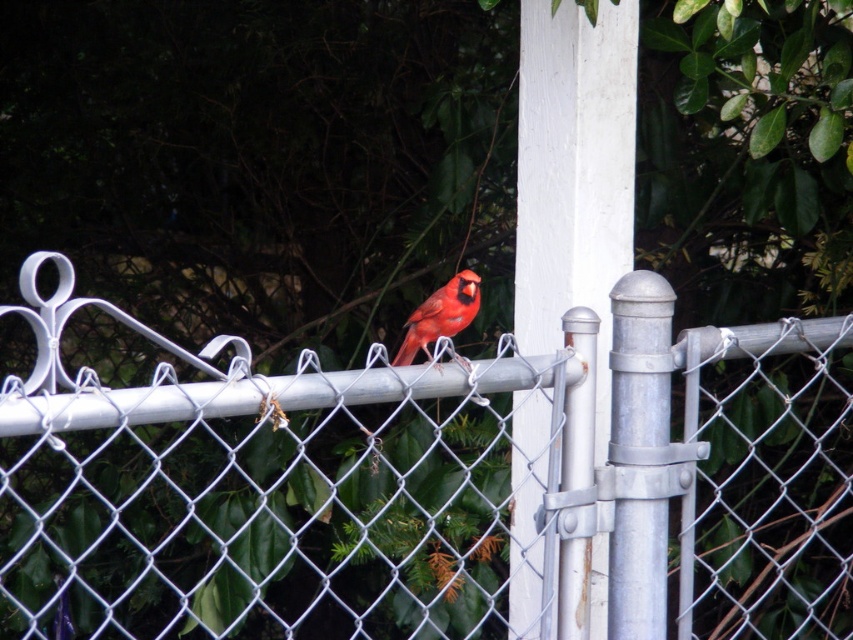
You are a drone operator trying to navigate between two points in the image. The first point is at coordinates point (x=550, y=401) and the second point is at coordinates point (x=635, y=596). Which point is closer to the camera?

Point (x=635, y=596) is closer to the camera because the description states that point (x=550, y=401) is behind point (x=635, y=596).